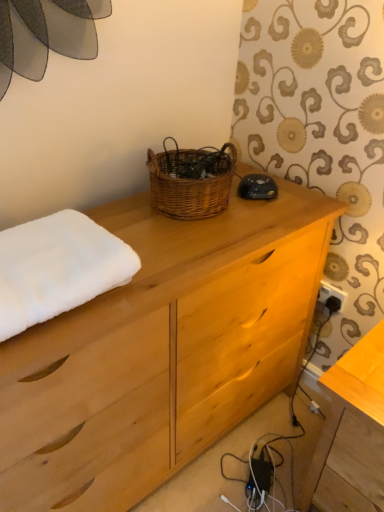
Question: In the image, is woven brown basket at center positioned in front of or behind wooden table at lower right?

Choices:
 (A) behind
 (B) front

Answer: (A)

Question: Is point (198, 218) positioned closer to the camera than point (352, 420)?

Choices:
 (A) closer
 (B) farther

Answer: (B)

Question: Estimate the real-world distances between objects in this image. Which object is closer to the white plastic electric outlet at lower right?

Choices:
 (A) woven brown basket at center
 (B) wooden table at lower right
 (C) natural wood chest of drawers at center
 (D) white fluffy towel at left

Answer: (B)

Question: Estimate the real-world distances between objects in this image. Which object is farther from the wooden table at lower right?

Choices:
 (A) woven brown basket at center
 (B) natural wood chest of drawers at center
 (C) white fluffy towel at left
 (D) white plastic electric outlet at lower right

Answer: (C)